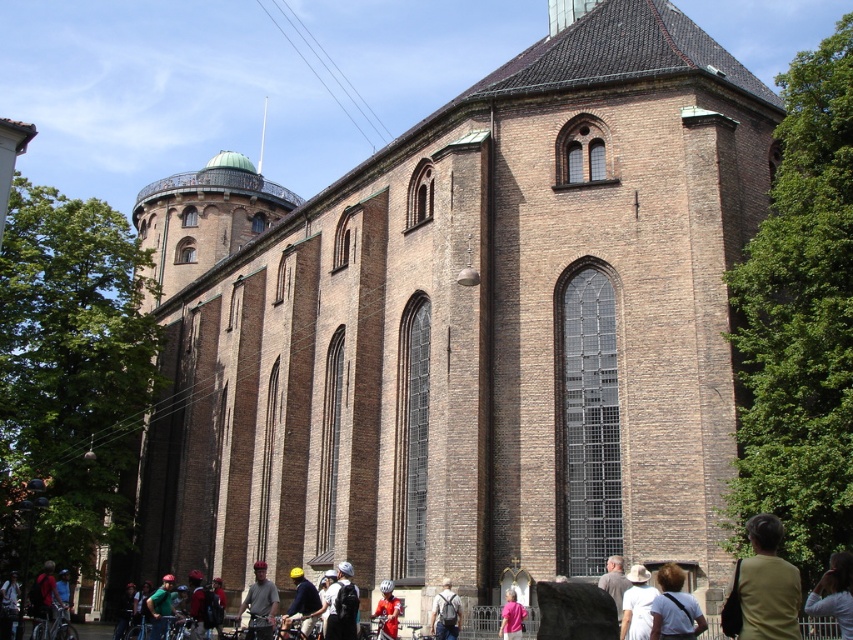
Between matte brown hair at lower right and red matte helmet at center, which one is positioned higher?

matte brown hair at lower right

Does matte brown hair at lower right appear on the right side of red matte helmet at center?

Indeed, matte brown hair at lower right is positioned on the right side of red matte helmet at center.

What do you see at coordinates (674, 608) in the screenshot? I see `matte brown hair at lower right` at bounding box center [674, 608].

Identify the location of matte brown hair at lower right. (674, 608).

Looking at this image, is matte brown hair at lower right taller than denim jacket at lower left?

No, matte brown hair at lower right is not taller than denim jacket at lower left.

Does matte brown hair at lower right have a lesser width compared to denim jacket at lower left?

Correct, matte brown hair at lower right's width is less than denim jacket at lower left's.

Who is more forward, (x=666, y=637) or (x=4, y=609)?

Positioned in front is point (x=666, y=637).

Where is `matte brown hair at lower right`? matte brown hair at lower right is located at coordinates (x=674, y=608).

Between denim jacket at lower left and pink fabric at lower center, which one appears on the left side from the viewer's perspective?

denim jacket at lower left is more to the left.

Between point (12, 586) and point (502, 618), which one is positioned in front?

Point (502, 618) is more forward.

Does point (1, 595) lie in front of point (509, 636)?

That is False.

The image size is (853, 640). Find the location of `denim jacket at lower left`. denim jacket at lower left is located at coordinates pos(9,605).